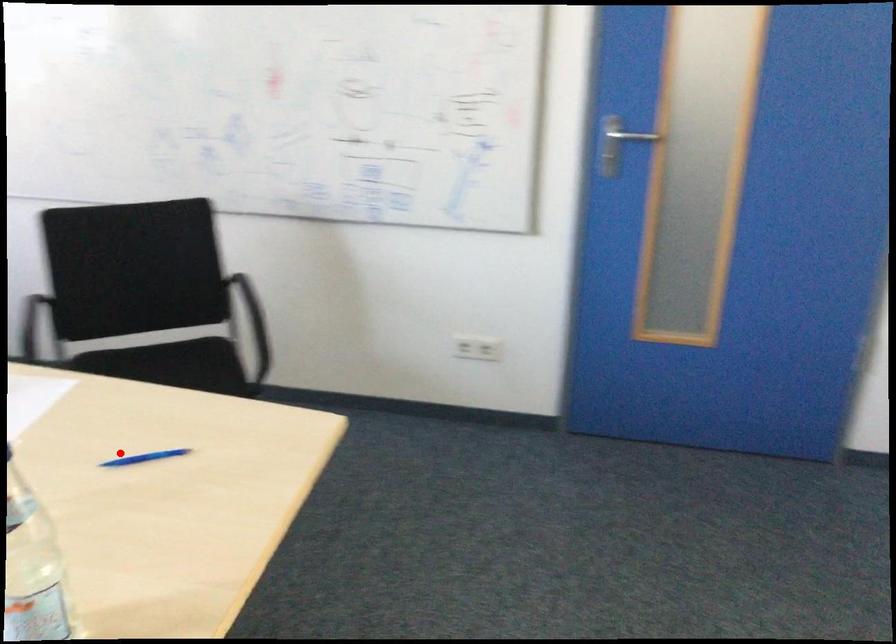
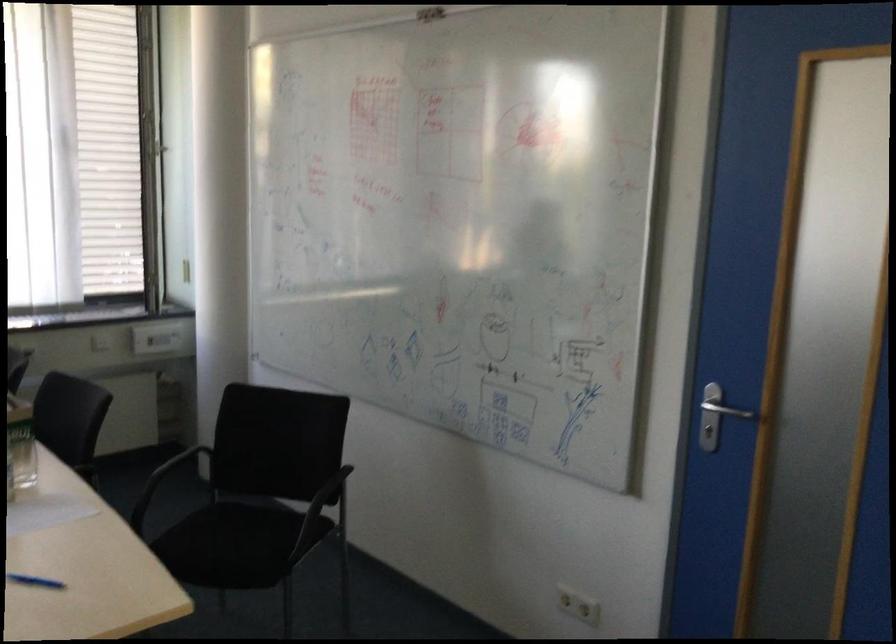
Question: I am providing you with two images of the same scene from different viewpoints. In image1, a red point is highlighted. Considering the same 3D point in image2, which of the following is correct?

Choices:
 (A) It is closer
 (B) It is farther

Answer: (B)